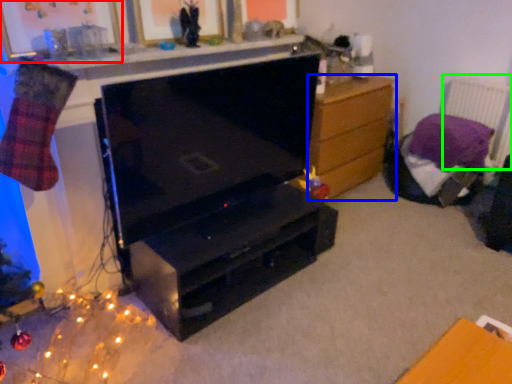
Question: Which object is the farthest from picture frame (highlighted by a red box)? Choose among these: chest of drawers (highlighted by a blue box) or radiator (highlighted by a green box).

Choices:
 (A) chest of drawers
 (B) radiator

Answer: (B)